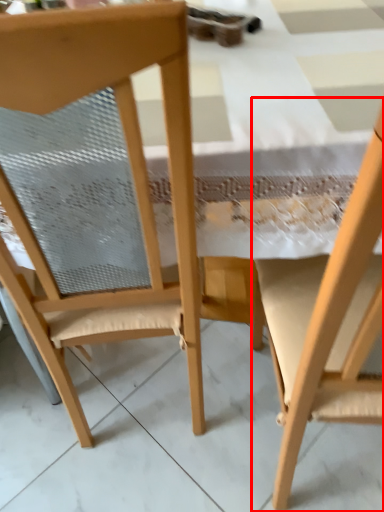
Question: Where is chair (annotated by the red box) located in relation to chair in the image?

Choices:
 (A) right
 (B) left

Answer: (A)